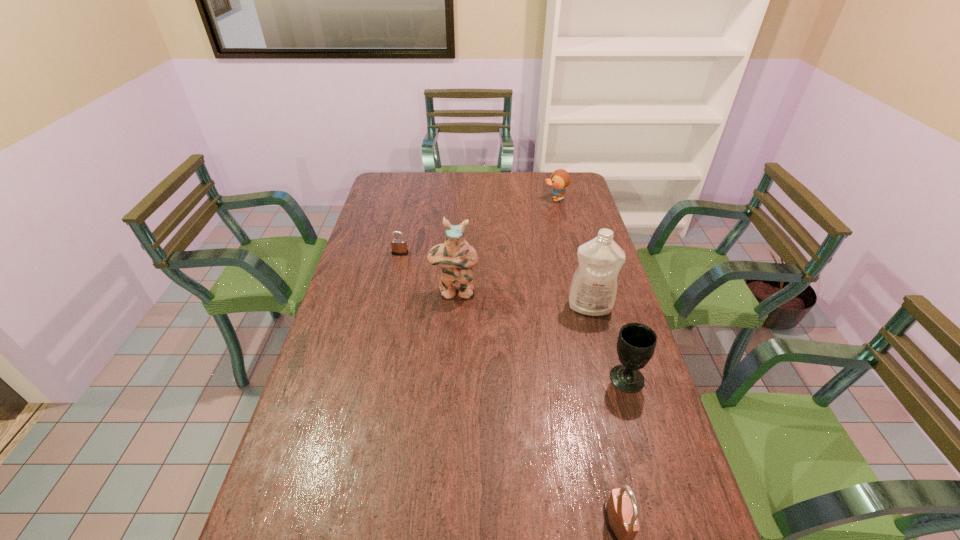
If equal spacing is the goal by inserting an additional padlock among them, please point out a vacant space for this new padlock. Please provide its 2D coordinates. Your answer should be formatted as a tuple, i.e. [(x, y)], where the tuple contains the x and y coordinates of a point satisfying the conditions above.

[(479, 352)]